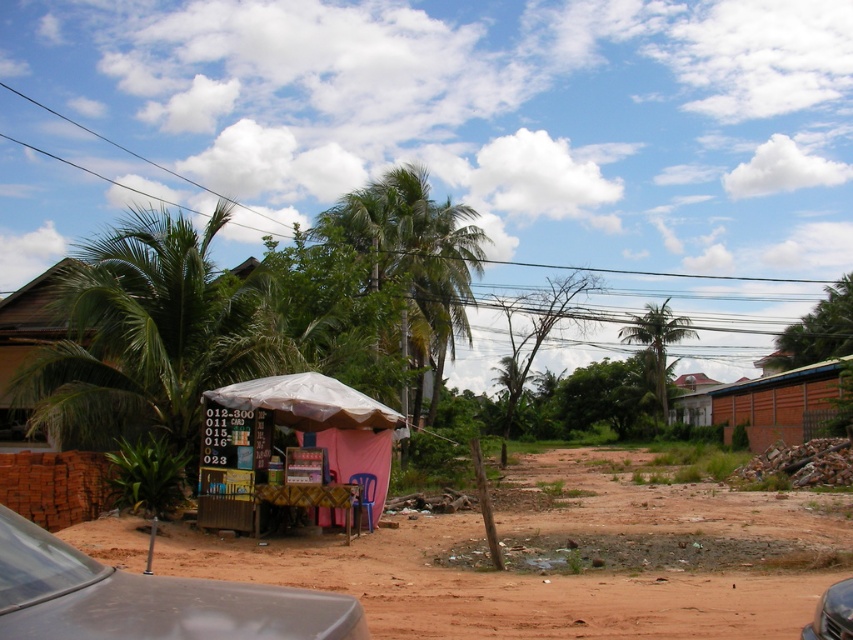
Question: Is green leafy palm tree at left thinner than green leafy palm tree at center-right?

Choices:
 (A) yes
 (B) no

Answer: (B)

Question: Which of these objects is positioned closest to the brown dirt field at lower left?

Choices:
 (A) green leafy palm tree at center
 (B) metallic gray car at lower left
 (C) brown corrugated metal hut at right
 (D) metallic gray car at lower right

Answer: (A)

Question: Which of the following is the farthest from the observer?

Choices:
 (A) (425, 252)
 (B) (206, 339)
 (C) (42, 579)

Answer: (A)

Question: Does brown dirt field at lower left appear over green leafy palm tree at center?

Choices:
 (A) yes
 (B) no

Answer: (B)

Question: Which point is farther to the camera?

Choices:
 (A) (793, 385)
 (B) (155, 416)

Answer: (A)

Question: Is green leafy palm tree at center-right positioned in front of metallic gray car at lower right?

Choices:
 (A) yes
 (B) no

Answer: (B)